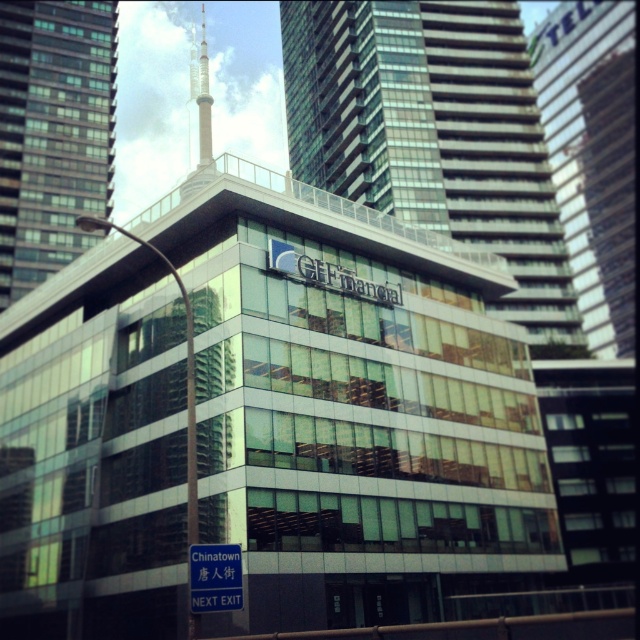
Which of these two, glassy reflective building at center or blue plastic street sign at lower center, stands taller?

Standing taller between the two is glassy reflective building at center.

In the scene shown: Could you measure the distance between glassy reflective building at center and blue plastic street sign at lower center?

The distance of glassy reflective building at center from blue plastic street sign at lower center is 101.39 meters.

Who is more forward, [509,36] or [189,552]?

Positioned in front is point [189,552].

Locate an element on the screen. glassy reflective building at center is located at coordinates (435, 134).

Is glassy skyscraper at center smaller than glassy skyscraper at upper right?

Yes, glassy skyscraper at center is smaller than glassy skyscraper at upper right.

Between glassy skyscraper at center and glassy skyscraper at upper right, which one has less height?

With less height is glassy skyscraper at center.

What do you see at coordinates (52, 132) in the screenshot? The image size is (640, 640). I see `glassy skyscraper at center` at bounding box center [52, 132].

This screenshot has width=640, height=640. In order to click on glassy skyscraper at center in this screenshot , I will do `click(52, 132)`.

Between glassy reflective building at center and glassy skyscraper at upper right, which one appears on the right side from the viewer's perspective?

glassy skyscraper at upper right is more to the right.

Can you confirm if glassy reflective building at center is shorter than glassy skyscraper at upper right?

No, glassy reflective building at center is not shorter than glassy skyscraper at upper right.

Which is behind, point (452, 100) or point (589, 48)?

The point (589, 48) is more distant.

You are a GUI agent. You are given a task and a screenshot of the screen. Output one action in this format:
    pyautogui.click(x=<x>, y=<y>)
    Task: Click on the glassy reflective building at center
    
    Given the screenshot: What is the action you would take?
    pyautogui.click(x=435, y=134)